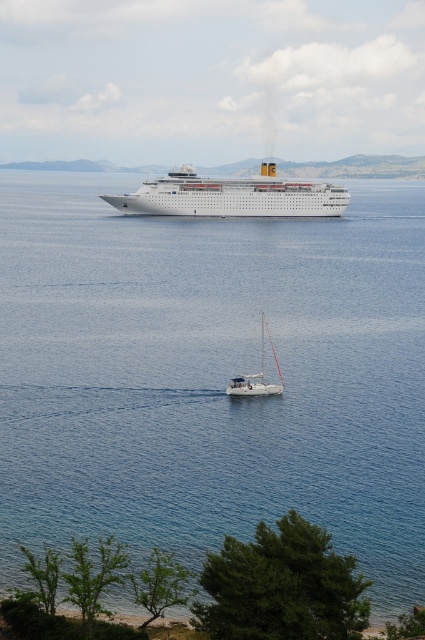
Is point (44, 353) farther from viewer compared to point (249, 387)?

That is True.

Is point (150, 346) positioned in front of point (234, 390)?

No, it is behind (234, 390).

The height and width of the screenshot is (640, 425). I want to click on clear blue water at center, so click(x=212, y=376).

Which is below, clear blue water at center or white glossy cruise ship at center?

clear blue water at center is below.

Is point (209, 394) in front of point (277, 196)?

Yes, it is.

Image resolution: width=425 pixels, height=640 pixels. In order to click on clear blue water at center in this screenshot , I will do `click(212, 376)`.

Is white glossy cruise ship at center bigger than white matte sailboat at center?

Correct, white glossy cruise ship at center is larger in size than white matte sailboat at center.

Which is more to the right, white glossy cruise ship at center or white matte sailboat at center?

Positioned to the right is white matte sailboat at center.

The image size is (425, 640). Identify the location of white glossy cruise ship at center. (232, 195).